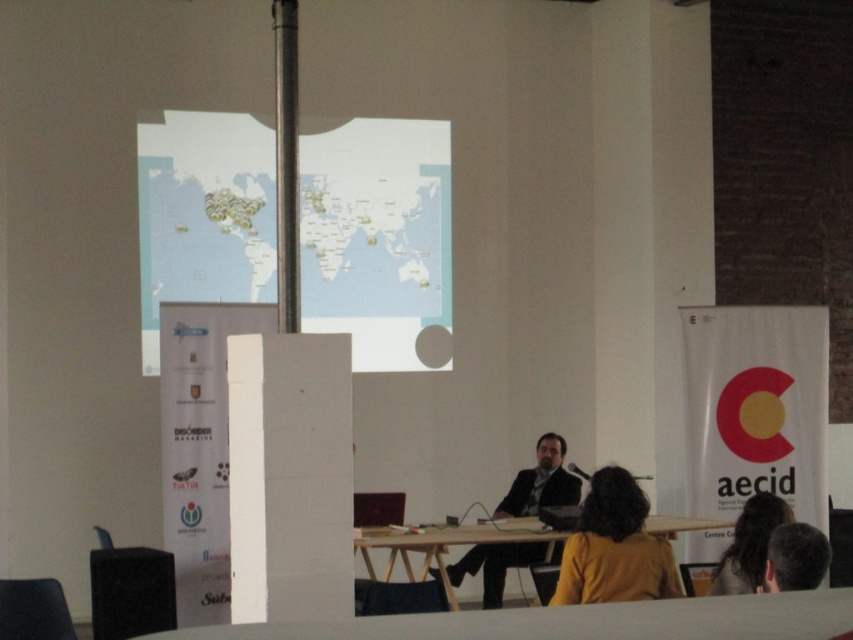
Question: Which point is closer to the camera taking this photo?

Choices:
 (A) (746, 500)
 (B) (370, 208)
 (C) (659, 582)
 (D) (537, 452)

Answer: (C)

Question: From the image, what is the correct spatial relationship of wooden at center in relation to gray hair at upper right?

Choices:
 (A) left
 (B) right

Answer: (A)

Question: Is the position of yellow fabric jacket at center less distant than that of dark brown hair at lower right?

Choices:
 (A) yes
 (B) no

Answer: (A)

Question: Estimate the real-world distances between objects in this image. Which object is closer to the dark suit at center?

Choices:
 (A) white matte map at upper center
 (B) gray hair at upper right

Answer: (A)

Question: Is white matte map at upper center closer to the viewer compared to gray hair at upper right?

Choices:
 (A) yes
 (B) no

Answer: (B)

Question: Which of these objects is positioned closest to the wooden at center?

Choices:
 (A) white matte map at upper center
 (B) dark suit at center
 (C) yellow fabric jacket at center

Answer: (B)